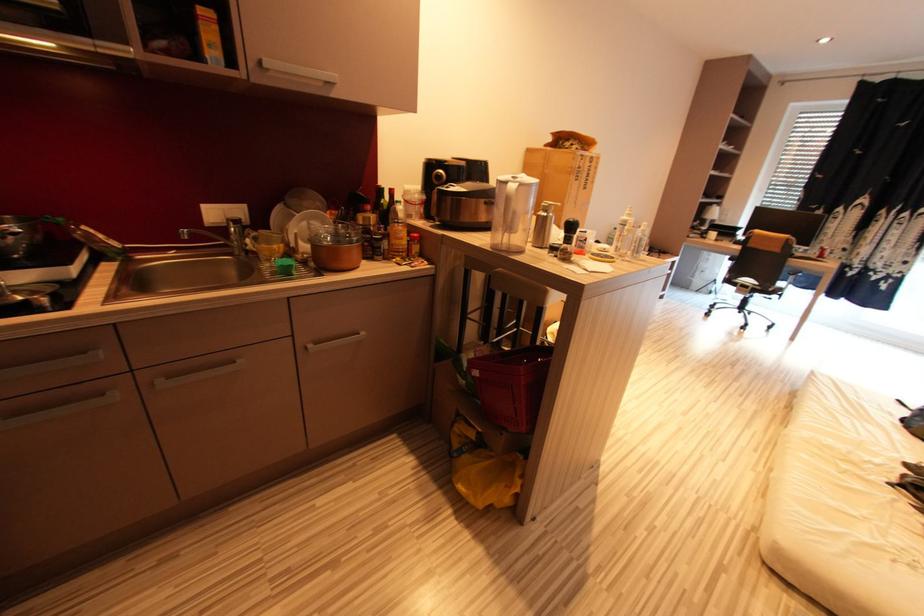
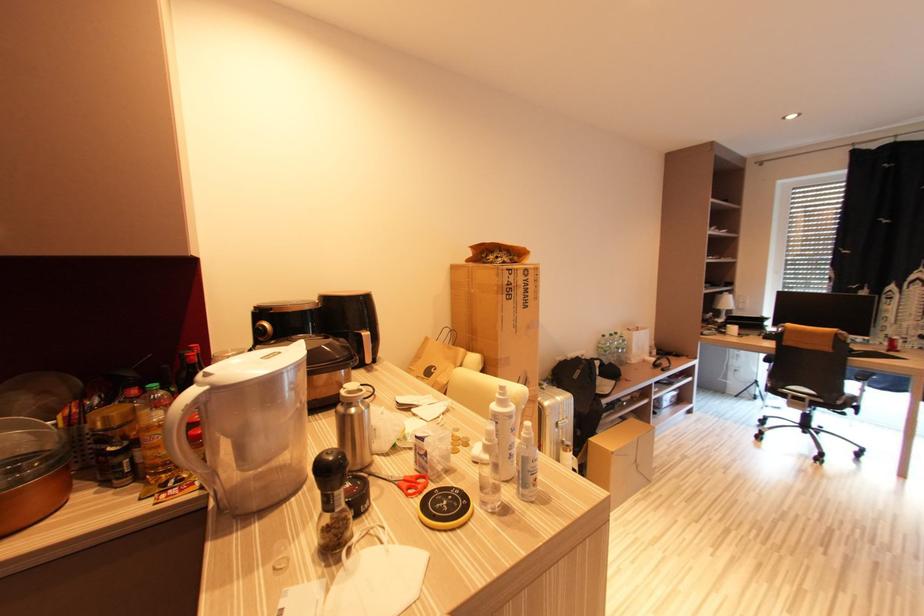
In a continuous first-person perspective shot, in which direction is the camera moving?

The cameraman moved toward right, forward.